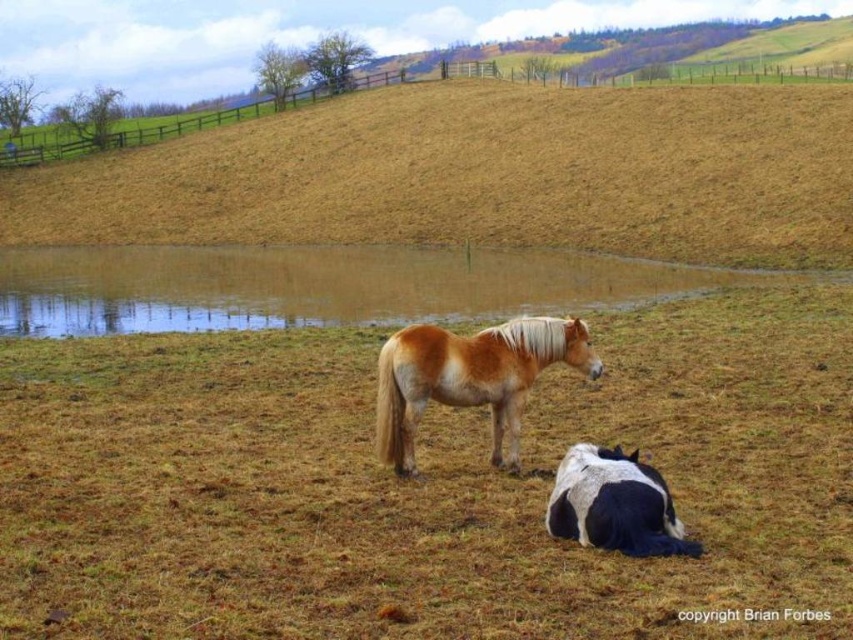
Can you confirm if brown water at center is bigger than golden-brown mane horse at center?

Yes.

Does brown water at center appear on the left side of golden-brown mane horse at center?

Yes, brown water at center is to the left of golden-brown mane horse at center.

Is point (421, 292) more distant than point (503, 326)?

Yes.

This screenshot has height=640, width=853. I want to click on brown water at center, so click(x=323, y=285).

Is the position of brown dry grass at center less distant than that of brown water at center?

That is True.

Is brown dry grass at center to the right of brown water at center from the viewer's perspective?

Yes, brown dry grass at center is to the right of brown water at center.

Locate an element on the screen. brown dry grass at center is located at coordinates (421, 484).

Who is more distant from viewer, [509,225] or [387,284]?

Positioned behind is point [509,225].

Find the location of a particular element. This screenshot has height=640, width=853. brown grassy hillside at upper center is located at coordinates (483, 173).